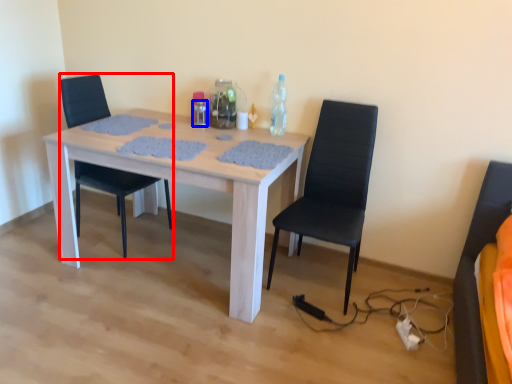
Question: Which point is closer to the camera, chair (highlighted by a red box) or bottle (highlighted by a blue box)?

Choices:
 (A) chair
 (B) bottle

Answer: (A)